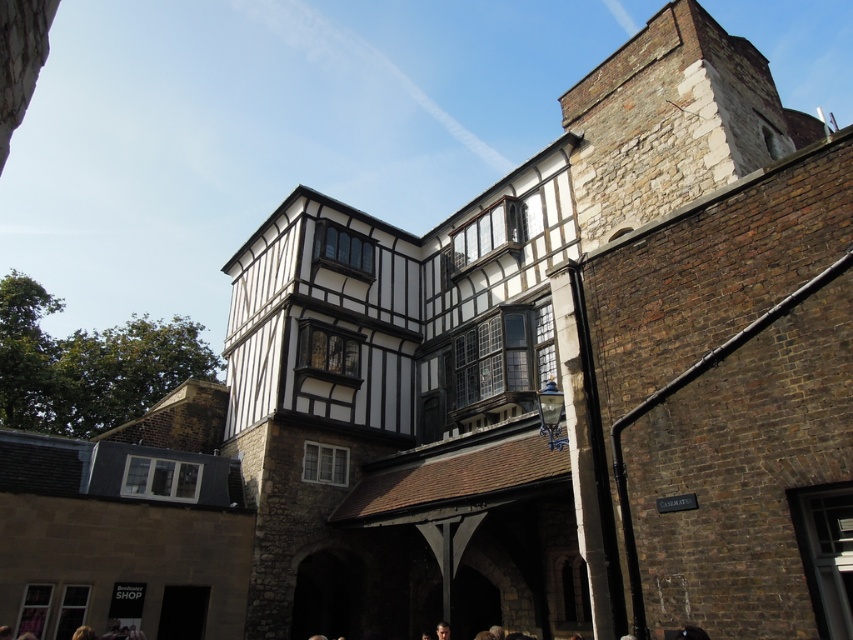
Question: Is the position of white timber-framed building at center more distant than that of dark brown hair at lower center?

Choices:
 (A) no
 (B) yes

Answer: (A)

Question: Does white timber-framed building at center appear on the left side of dark brown hair at lower center?

Choices:
 (A) yes
 (B) no

Answer: (B)

Question: Estimate the real-world distances between objects in this image. Which object is farther from the white timber-framed building at center?

Choices:
 (A) dark brown hair at lower center
 (B) blonde hair at lower left

Answer: (B)

Question: Which point is closer to the camera taking this photo?

Choices:
 (A) (254, 500)
 (B) (93, 636)
 (C) (447, 636)

Answer: (B)

Question: Is white timber-framed building at center positioned behind blonde hair at lower left?

Choices:
 (A) yes
 (B) no

Answer: (B)

Question: Which object is positioned farthest from the dark brown hair at lower center?

Choices:
 (A) blonde hair at lower left
 (B) white timber-framed building at center

Answer: (B)